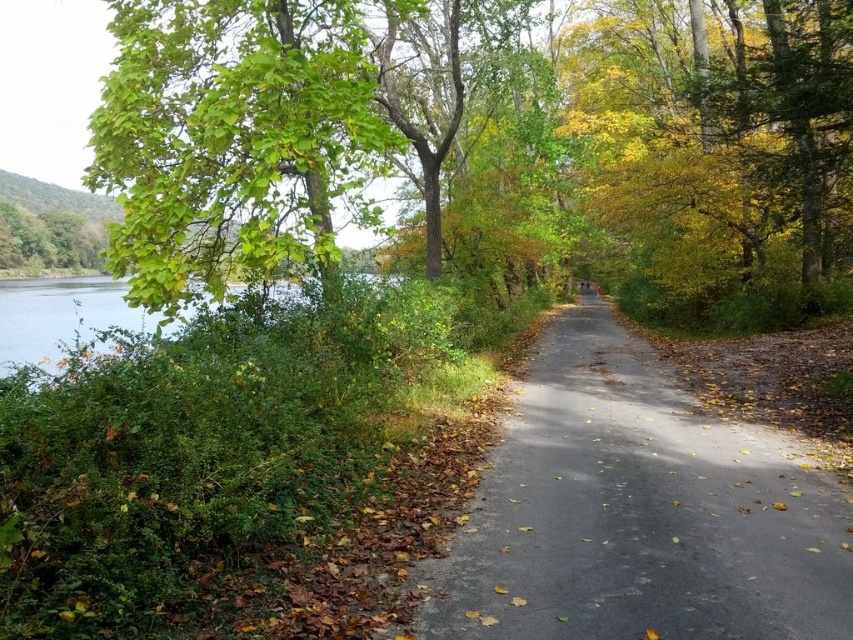
Consider the image. Is green leafy tree at upper left below clear water at left?

Actually, green leafy tree at upper left is above clear water at left.

Can you confirm if green leafy tree at upper left is bigger than clear water at left?

Correct, green leafy tree at upper left is larger in size than clear water at left.

Does point (416, 26) lie in front of point (134, 316)?

That is True.

You are a GUI agent. You are given a task and a screenshot of the screen. Output one action in this format:
    pyautogui.click(x=<x>, y=<y>)
    Task: Click on the green leafy tree at upper left
    The width and height of the screenshot is (853, 640).
    Given the screenshot: What is the action you would take?
    pyautogui.click(x=498, y=144)

Can you confirm if gray asphalt road at center is smaller than clear water at left?

Yes, gray asphalt road at center is smaller than clear water at left.

Is point (781, 461) less distant than point (154, 314)?

Yes, it is in front of point (154, 314).

Locate an element on the screen. gray asphalt road at center is located at coordinates (637, 513).

Who is positioned more to the left, green leafy tree at upper left or gray asphalt road at center?

gray asphalt road at center is more to the left.

Which is behind, point (223, 68) or point (532, 476)?

The point (223, 68) is more distant.

Find the location of a particular element. Image resolution: width=853 pixels, height=640 pixels. green leafy tree at upper left is located at coordinates (498, 144).